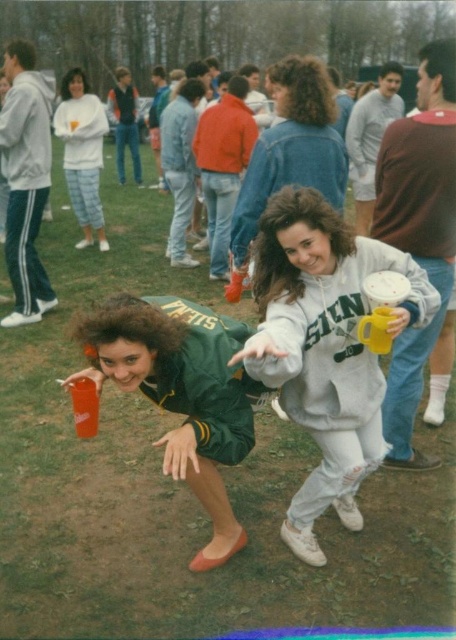
Between green fabric jacket at center and white fleece sweatshirt at upper left, which one has less height?

green fabric jacket at center

Where is `green fabric jacket at center`? The width and height of the screenshot is (456, 640). green fabric jacket at center is located at coordinates (181, 394).

What do you see at coordinates (181, 394) in the screenshot?
I see `green fabric jacket at center` at bounding box center [181, 394].

Where is `green fabric jacket at center`? The image size is (456, 640). green fabric jacket at center is located at coordinates (181, 394).

Is green fabric jacket at center smaller than translucent plastic cup at lower left?

Actually, green fabric jacket at center might be larger than translucent plastic cup at lower left.

Is green fabric jacket at center positioned at the back of translucent plastic cup at lower left?

No, green fabric jacket at center is closer to the viewer.

What do you see at coordinates (181, 394) in the screenshot? This screenshot has height=640, width=456. I see `green fabric jacket at center` at bounding box center [181, 394].

The image size is (456, 640). In order to click on green fabric jacket at center in this screenshot , I will do `click(181, 394)`.

Does white fleece sweatshirt at center have a smaller size compared to green fabric jacket at center?

Actually, white fleece sweatshirt at center might be larger than green fabric jacket at center.

Locate an element on the screen. The height and width of the screenshot is (640, 456). white fleece sweatshirt at center is located at coordinates click(325, 348).

Where is `white fleece sweatshirt at center`? The image size is (456, 640). white fleece sweatshirt at center is located at coordinates (325, 348).

I want to click on white fleece sweatshirt at center, so click(x=325, y=348).